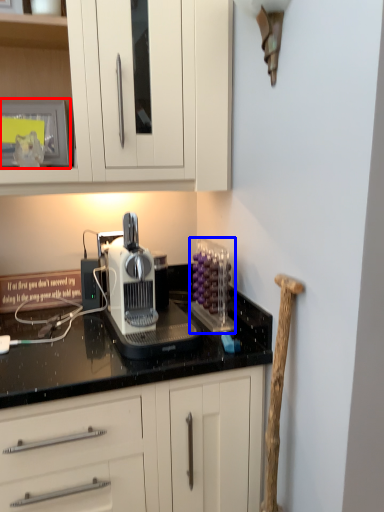
Question: Among these objects, which one is nearest to the camera, appliance (highlighted by a red box) or kitchen appliance (highlighted by a blue box)?

Choices:
 (A) appliance
 (B) kitchen appliance

Answer: (B)